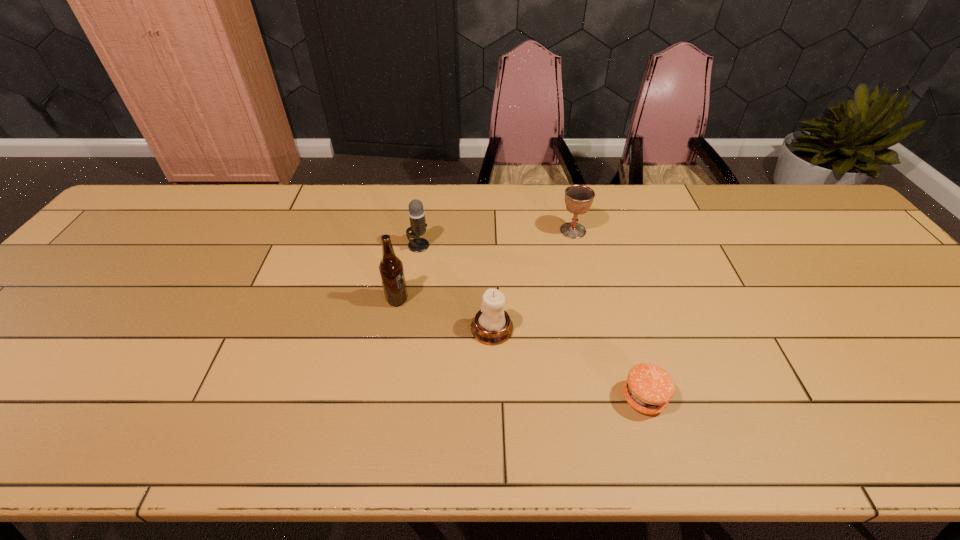
Identify which object is the nearest to the shortest object. Please provide its 2D coordinates. Your answer should be formatted as a tuple, i.e. [(x, y)], where the tuple contains the x and y coordinates of a point satisfying the conditions above.

[(492, 325)]

Find the location of a particular element. free spot that satisfies the following two spatial constraints: 1. on the label of the patty; 2. on the right side of the tallest object is located at coordinates (380, 398).

This screenshot has height=540, width=960. I want to click on free space that satisfies the following two spatial constraints: 1. on the label of the fourth farthest object; 2. on the right side of the beer bottle, so click(x=392, y=328).

The height and width of the screenshot is (540, 960). Find the location of `blank area in the image that satisfies the following two spatial constraints: 1. on the label of the fourth farthest object; 2. on the left side of the third nearest object`. blank area in the image that satisfies the following two spatial constraints: 1. on the label of the fourth farthest object; 2. on the left side of the third nearest object is located at coordinates [x=392, y=328].

I want to click on vacant space that satisfies the following two spatial constraints: 1. on the back side of the nearest object; 2. on the label of the tallest object, so click(615, 300).

Where is `vacant space that satisfies the following two spatial constraints: 1. on the label of the nearest object; 2. on the right side of the third nearest object`? This screenshot has height=540, width=960. vacant space that satisfies the following two spatial constraints: 1. on the label of the nearest object; 2. on the right side of the third nearest object is located at coordinates (380, 398).